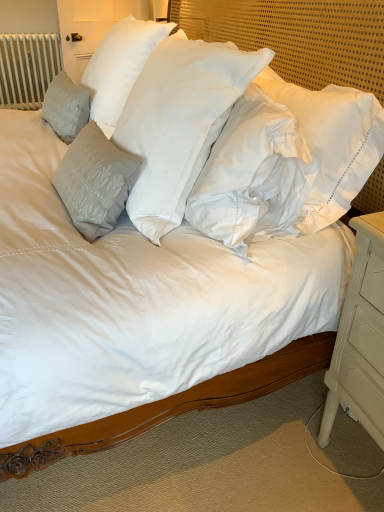
Question: Considering the relative sizes of white cotton pillow at center, acting as the 3th pillow starting from the left, and satin gray pillow at left, the 2th pillow positioned from the right, in the image provided, is white cotton pillow at center, acting as the 3th pillow starting from the left, taller than satin gray pillow at left, the 2th pillow positioned from the right,?

Choices:
 (A) yes
 (B) no

Answer: (A)

Question: Can you confirm if white cotton pillow at center, acting as the 3th pillow starting from the left, is shorter than satin gray pillow at left, the 2th pillow positioned from the right?

Choices:
 (A) yes
 (B) no

Answer: (B)

Question: Is white cotton pillow at center, acting as the 3th pillow starting from the left, positioned behind satin gray pillow at left, the 2th pillow viewed from the left?

Choices:
 (A) yes
 (B) no

Answer: (B)

Question: From a real-world perspective, is white cotton pillow at center, arranged as the 1th pillow when viewed from the right, over satin gray pillow at left, the 2th pillow positioned from the right?

Choices:
 (A) no
 (B) yes

Answer: (A)

Question: From a real-world perspective, is white cotton pillow at center, arranged as the 1th pillow when viewed from the right, physically below satin gray pillow at left, the 2th pillow viewed from the left?

Choices:
 (A) yes
 (B) no

Answer: (A)

Question: Considering the positions of white painted wood nightstand at lower right and white cotton pillow at center, acting as the 3th pillow starting from the left, in the image, is white painted wood nightstand at lower right bigger or smaller than white cotton pillow at center, acting as the 3th pillow starting from the left,?

Choices:
 (A) big
 (B) small

Answer: (B)

Question: Considering the positions of point (329, 415) and point (175, 161), is point (329, 415) closer or farther from the camera than point (175, 161)?

Choices:
 (A) closer
 (B) farther

Answer: (B)

Question: From a real-world perspective, is white painted wood nightstand at lower right positioned above or below white cotton pillow at center, arranged as the 1th pillow when viewed from the right?

Choices:
 (A) above
 (B) below

Answer: (B)

Question: In terms of width, does white painted wood nightstand at lower right look wider or thinner when compared to white cotton pillow at center, acting as the 3th pillow starting from the left?

Choices:
 (A) wide
 (B) thin

Answer: (A)

Question: In the image, is white cotton pillow at center, acting as the 3th pillow starting from the left, positioned in front of or behind white painted metal radiator at upper left?

Choices:
 (A) front
 (B) behind

Answer: (A)

Question: Is white cotton pillow at center, acting as the 3th pillow starting from the left, wider or thinner than white painted metal radiator at upper left?

Choices:
 (A) wide
 (B) thin

Answer: (A)

Question: Do you think white cotton pillow at center, acting as the 3th pillow starting from the left, is within white painted metal radiator at upper left, or outside of it?

Choices:
 (A) outside
 (B) inside

Answer: (A)

Question: In the image, is white cotton pillow at center, acting as the 3th pillow starting from the left, on the left side or the right side of white painted metal radiator at upper left?

Choices:
 (A) left
 (B) right

Answer: (B)

Question: Is point (145, 166) closer or farther from the camera than point (82, 90)?

Choices:
 (A) closer
 (B) farther

Answer: (A)

Question: From the image's perspective, is white cotton pillow at center, arranged as the 1th pillow when viewed from the right, positioned above or below gray textured pillow at left, arranged as the third pillow when viewed from the right?

Choices:
 (A) above
 (B) below

Answer: (B)